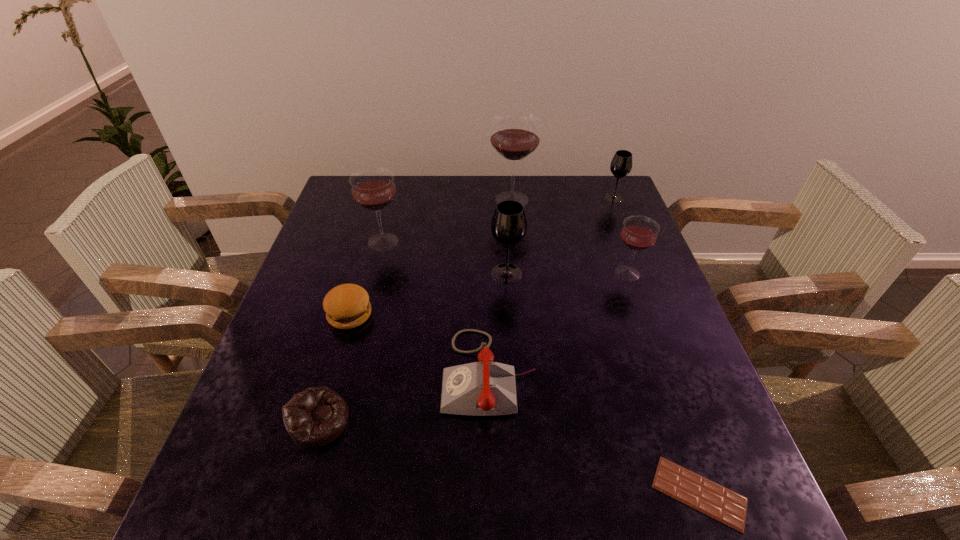
Identify the location of telephone. This screenshot has height=540, width=960. click(x=485, y=388).

I want to click on hamburger, so click(347, 306).

Identify the location of brown beanbag. The image size is (960, 540). (315, 417).

Locate an element on the screen. beanbag is located at coordinates (315, 417).

This screenshot has height=540, width=960. What are the coordinates of `brown chocolate bar` in the screenshot? It's located at (718, 502).

Locate an element on the screen. The image size is (960, 540). the nearest object is located at coordinates (718, 502).

The height and width of the screenshot is (540, 960). Identify the location of free space located 0.360m on the front of the tallest wineglass. (521, 296).

I want to click on vacant space located 0.170m on the back of the leftmost red wineglass, so click(395, 197).

Locate an element on the screen. The image size is (960, 540). free space located on the front of the nearer gray wineglass is located at coordinates (509, 314).

This screenshot has width=960, height=540. What are the coordinates of `vacant space located on the back of the rightmost red wineglass` in the screenshot? It's located at (616, 244).